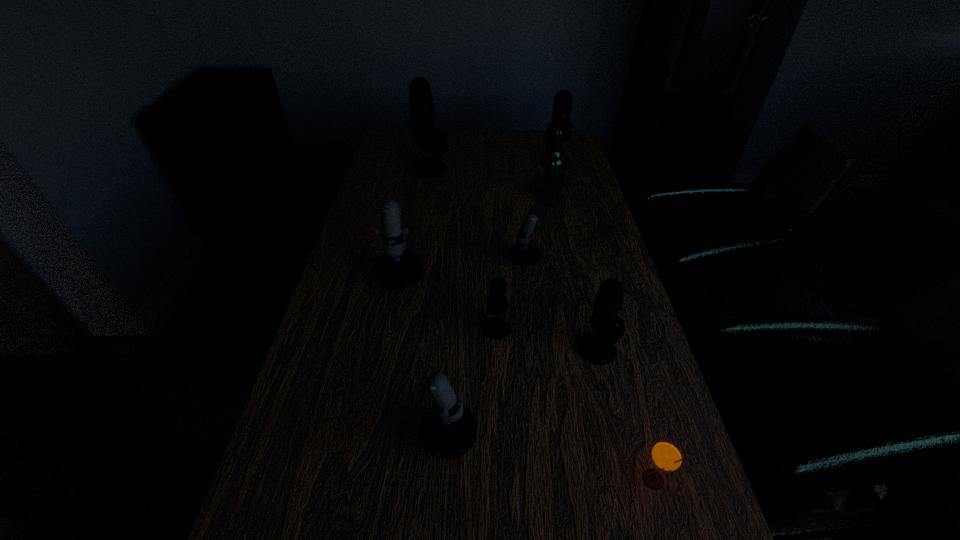
At what (x,y) coordinates should I click in order to perform the action: click on the fourth microphone from right to left. Please return your answer as a coordinate pair (x, y). This screenshot has width=960, height=540. Looking at the image, I should click on (495, 328).

The image size is (960, 540). What are the coordinates of `the second black microphone from left to right` in the screenshot? It's located at coord(495,328).

Identify the location of straw. (667, 455).

The height and width of the screenshot is (540, 960). I want to click on free space located on the front of the tallest object, so click(422, 208).

Identify the location of vacant space located 0.170m on the front of the third smallest black microphone. This screenshot has width=960, height=540. (564, 195).

Image resolution: width=960 pixels, height=540 pixels. Identify the location of free spot located 0.290m on the back of the beer bottle. (540, 154).

Locate an element on the screen. The width and height of the screenshot is (960, 540). vacant region located on the front of the biggest white microphone is located at coordinates (383, 371).

I want to click on vacant space located 0.070m on the right of the third biggest black microphone, so click(648, 349).

Identify the location of free region located on the right of the nearest microphone. The image size is (960, 540). (586, 438).

This screenshot has height=540, width=960. In order to click on vacant area located on the front of the smallest white microphone in this screenshot , I will do `click(564, 359)`.